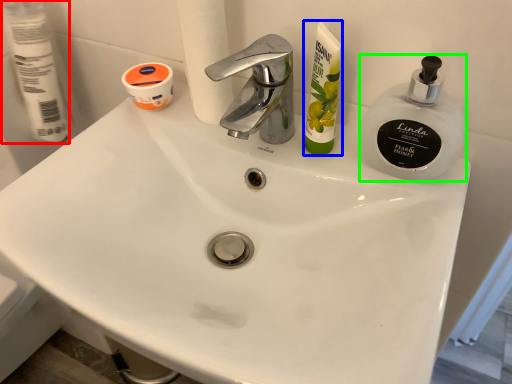
Question: Which object is the closest to the toilet paper (highlighted by a red box)? Choose among these: toiletry (highlighted by a blue box) or soap dispenser (highlighted by a green box).

Choices:
 (A) toiletry
 (B) soap dispenser

Answer: (A)